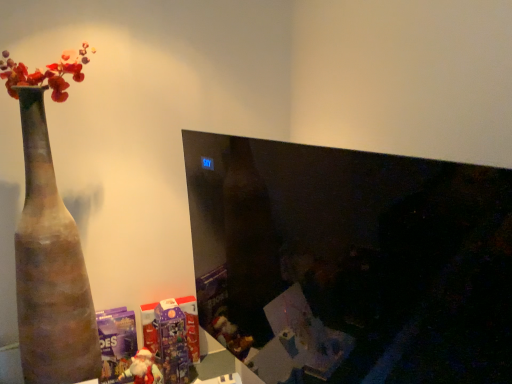
Question: From the image's perspective, is purple glossy advent calendar at lower center, the 2th toy when ordered from front to back, above or below matte plastic santa at lower left, which ranks as the first toy in front-to-back order?

Choices:
 (A) above
 (B) below

Answer: (A)

Question: Which is correct: purple glossy advent calendar at lower center, the 2th toy when ordered from front to back, is inside matte plastic santa at lower left, marked as the 2th toy in a back-to-front arrangement, or outside of it?

Choices:
 (A) inside
 (B) outside

Answer: (B)

Question: Which object is the closest to the black glossy monitor at center?

Choices:
 (A) terracotta vase at left
 (B) purple glossy advent calendar at lower center, the 2th toy when ordered from front to back
 (C) matte plastic santa at lower left, marked as the 2th toy in a back-to-front arrangement

Answer: (B)

Question: Which of these objects is positioned farthest from the matte plastic santa at lower left, marked as the 2th toy in a back-to-front arrangement?

Choices:
 (A) terracotta vase at left
 (B) black glossy monitor at center
 (C) purple glossy advent calendar at lower center, the 1th toy viewed from the back

Answer: (B)